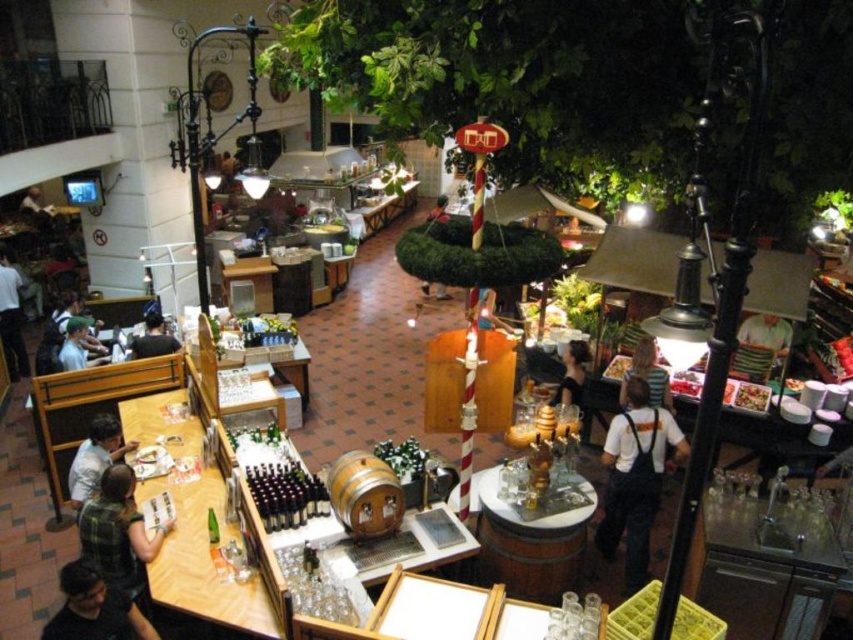
You are a customer in this restaurant and you want to sit at the table where the striped shirt at center and the green fabric shirt at left are located. Which shirt is closer to the entrance of the restaurant?

The green fabric shirt at left is closer to the entrance because the striped shirt at center is positioned on the right side of it, implying the green fabric shirt at left is nearer to the entrance.

You are a customer looking for a seat in the dining area. You see two people wearing the dark gray shirt at left and the green fabric shirt at left. Which one is closer to the entrance if the entrance is on the far left wall?

The dark gray shirt at left is closer to the entrance because it is positioned to the left of the green fabric shirt at left, and the entrance is on the far left wall.